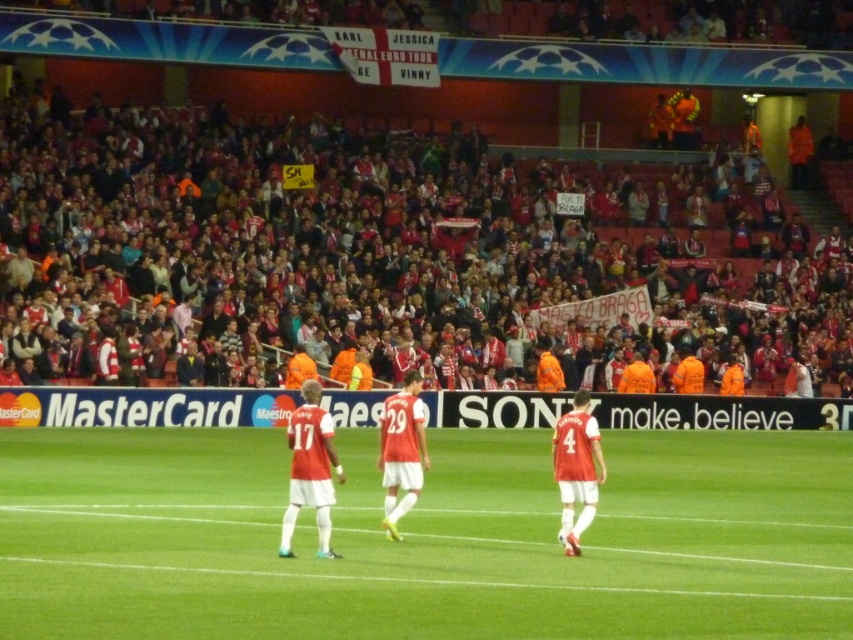
Question: Does red matte jersey at center appear under matte jersey at center?

Choices:
 (A) yes
 (B) no

Answer: (A)

Question: Which of the following is the closest to the observer?

Choices:
 (A) red jersey at center
 (B) red fabric crowd at upper center

Answer: (A)

Question: Can you confirm if red matte jersey at center is smaller than red jersey at center?

Choices:
 (A) no
 (B) yes

Answer: (A)

Question: Based on their relative distances, which object is farther from the red jersey at center?

Choices:
 (A) green grass field at center
 (B) matte jersey at center
 (C) matte red jersey at center
 (D) red matte jersey at center

Answer: (A)

Question: Does red fabric crowd at upper center have a larger size compared to matte red jersey at center?

Choices:
 (A) yes
 (B) no

Answer: (A)

Question: Among these objects, which one is nearest to the camera?

Choices:
 (A) green grass field at center
 (B) red fabric crowd at upper center
 (C) red jersey at center

Answer: (A)